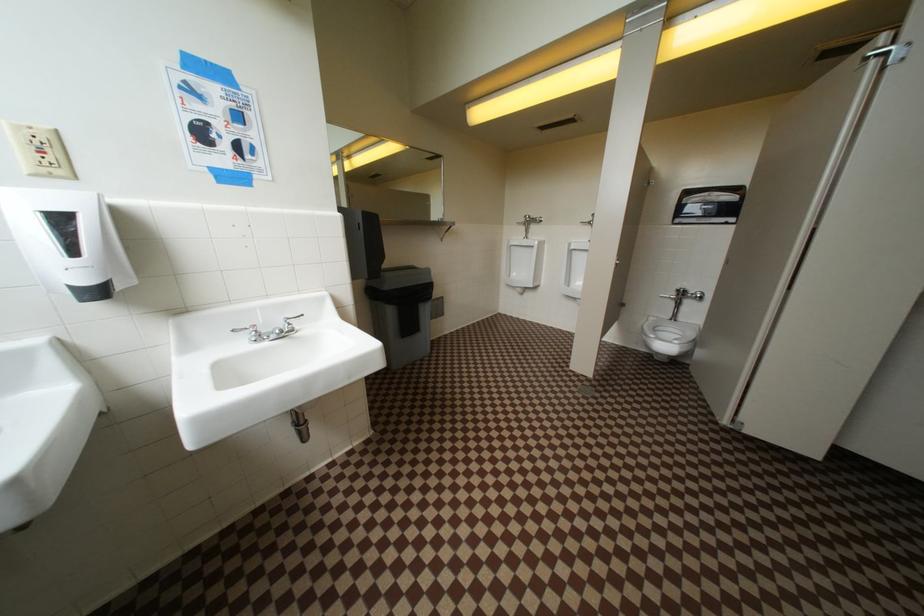
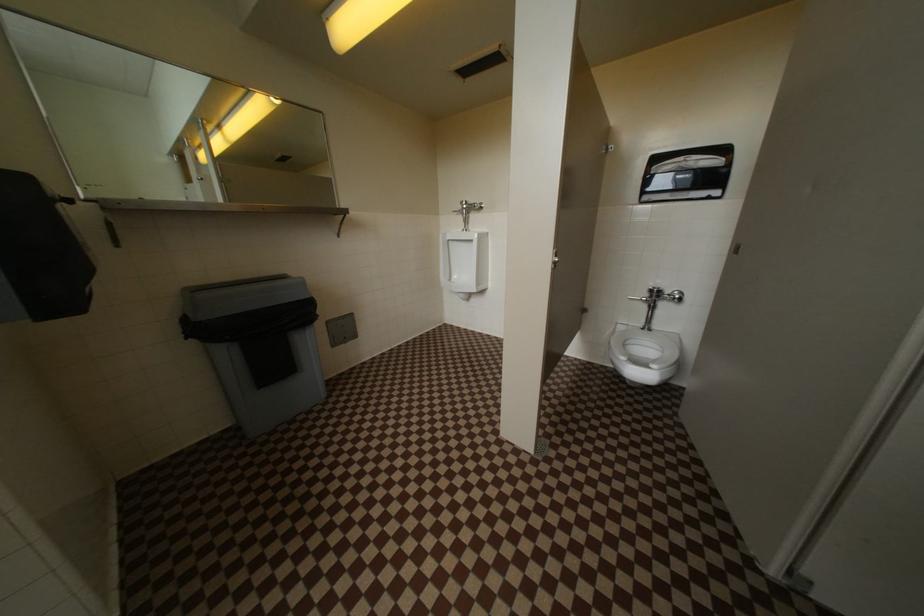
Question: The camera is either moving clockwise (left) or counter-clockwise (right) around the object. The first image is from the beginning of the video and the second image is from the end. Is the camera moving left or right when shooting the video?

Choices:
 (A) Left
 (B) Right

Answer: (A)